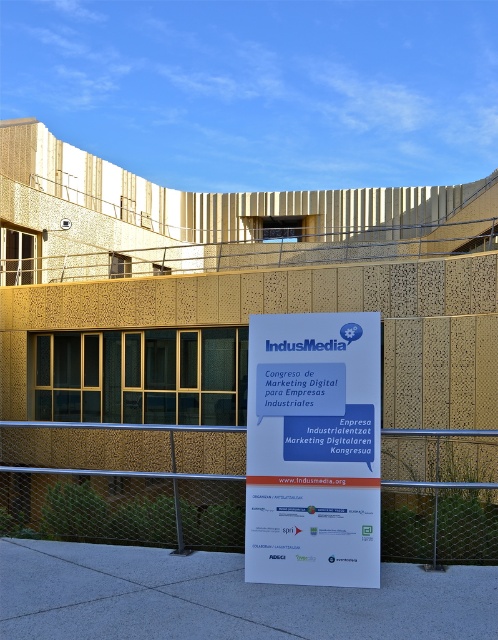
You are standing at the entrance of the building and see two points marked on the facade. The first point is at coordinate point (402, 536) and the second is at point (271, 531). Which point is closer to the entrance?

Point (271, 531) is closer to the entrance because it is in front of point (402, 536).

You are a visitor approaching the entrance of the building and see the wire mesh fence at center and the white paper sign at center. Which object is closer to the ground?

The wire mesh fence at center is closer to the ground because it is positioned below the white paper sign at center.